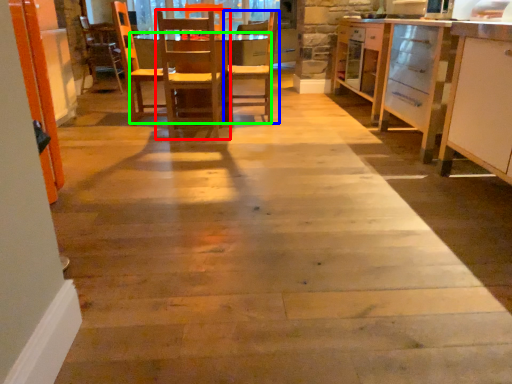
Question: Based on their relative distances, which object is farther from chair (highlighted by a red box)? Choose from chair (highlighted by a blue box) and table (highlighted by a green box).

Choices:
 (A) chair
 (B) table

Answer: (B)